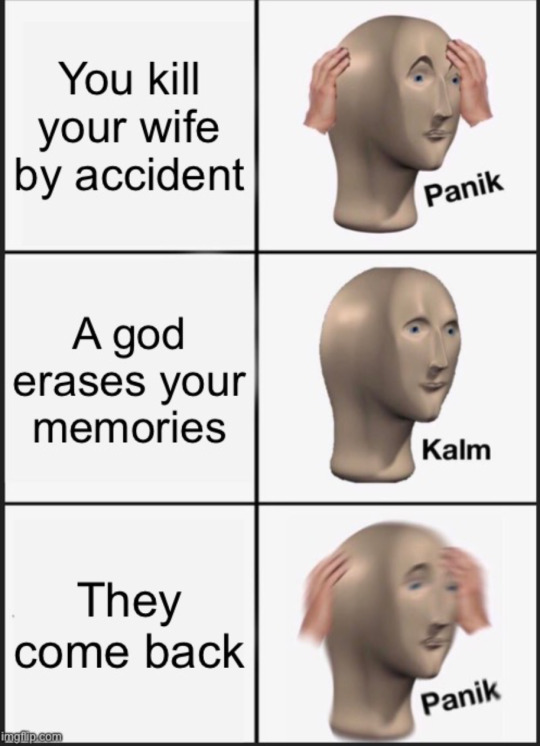
At what (x,y) coordinates should I click in order to perform the action: click on mannequin head. Please return your answer as a coordinate pair (x, y). Image resolution: width=540 pixels, height=746 pixels. Looking at the image, I should click on (368, 98), (363, 307), (369, 623).